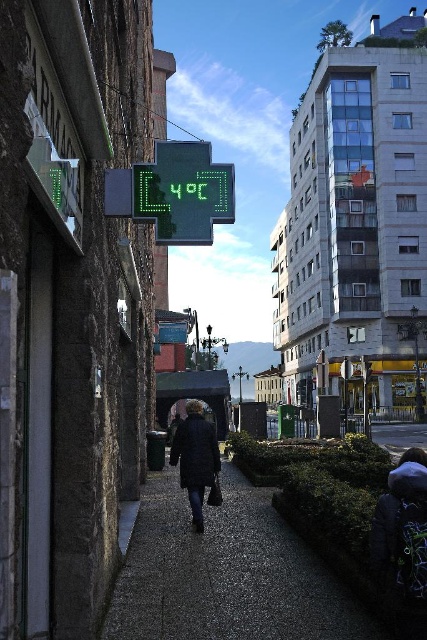
You are a tourist in this European city and you want to check the temperature displayed on the green plastic thermometer at upper center before deciding whether to wear your dark blue coat at center. Can you see the temperature reading from where you are standing?

The green plastic thermometer at upper center is located above the dark blue coat at center, so you can see the temperature reading from your current position as it is positioned above you.

You are standing on the paved walkway and want to walk to the covered pedestrian bridge. There are two paths available. One is the dark gray gravel at center and the other is the dark gray jacket at lower right. Which path should you take to reach the bridge faster?

The dark gray gravel at center is to the left of the dark gray jacket at lower right, so taking the path through the dark gray gravel at center would be closer and faster to reach the covered pedestrian bridge.

Based on the photo, you are standing on the walkway and want to place a small potted plant between the dark gray gravel at center and the green plastic thermometer at upper center. According to the scene description, where should you position the plant?

The dark gray gravel at center is to the right of the green plastic thermometer at upper center, so you should place the plant to the left of the dark gray gravel at center and to the right of the green plastic thermometer at upper center.